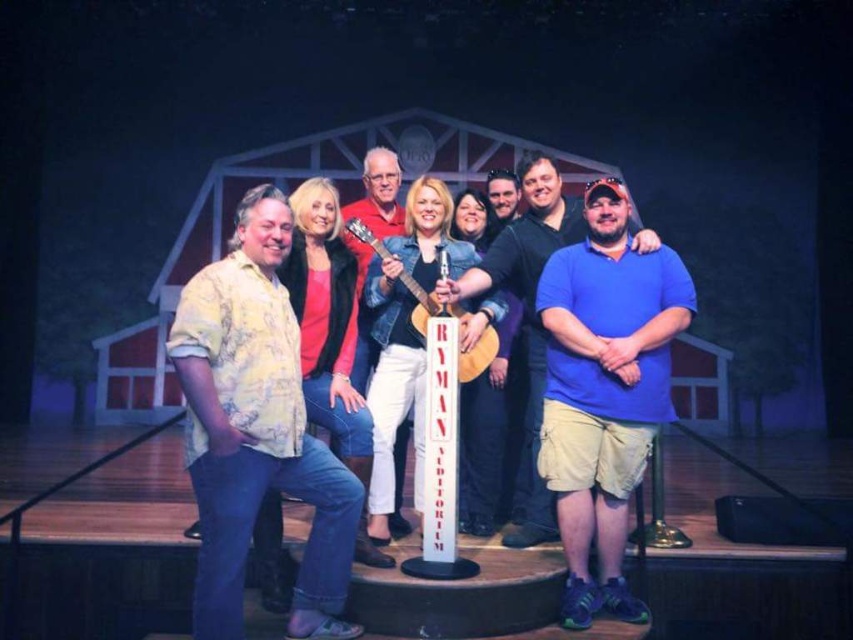
Describe the element at coordinates (256, 429) in the screenshot. I see `yellow floral shirt at left` at that location.

Is yellow floral shirt at left below matte red shirt at center?

Yes, yellow floral shirt at left is below matte red shirt at center.

Is point (238, 636) positioned after point (366, 358)?

No, it is in front of (366, 358).

Where is `yellow floral shirt at left`? This screenshot has width=853, height=640. yellow floral shirt at left is located at coordinates (256, 429).

Is point (253, 456) behind point (556, 483)?

No, it is in front of (556, 483).

Which is above, yellow floral shirt at left or blue cotton polo shirt at center?

Positioned higher is blue cotton polo shirt at center.

Is point (222, 604) farther from viewer compared to point (595, 452)?

No, (222, 604) is in front of (595, 452).

Identify the location of yellow floral shirt at left. pos(256,429).

How much distance is there between yellow floral shirt at left and wooden acoustic guitar at center?

A distance of 86.95 centimeters exists between yellow floral shirt at left and wooden acoustic guitar at center.

Describe the element at coordinates (256, 429) in the screenshot. I see `yellow floral shirt at left` at that location.

At what (x,y) coordinates should I click in order to perform the action: click on yellow floral shirt at left. Please return your answer as a coordinate pair (x, y). The height and width of the screenshot is (640, 853). Looking at the image, I should click on (256, 429).